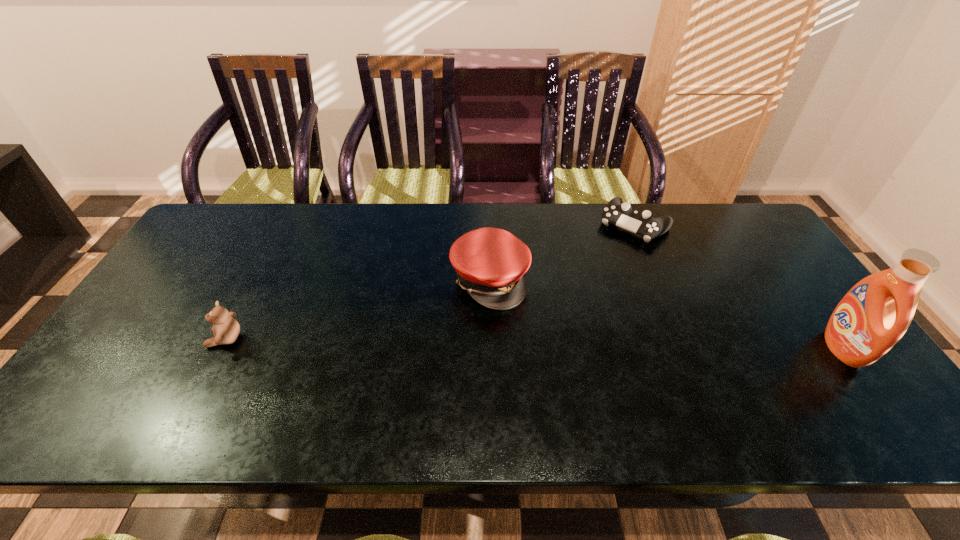
The width and height of the screenshot is (960, 540). I want to click on free space between the second object from left to right and the second object from right to left, so click(563, 252).

At what (x,y) coordinates should I click in order to perform the action: click on free space that is in between the rightmost object and the second farthest object. Please return your answer as a coordinate pair (x, y). The image size is (960, 540). Looking at the image, I should click on (666, 314).

This screenshot has height=540, width=960. I want to click on vacant area that lies between the leftmost object and the cap, so click(x=357, y=309).

What are the coordinates of `free space between the shortest object and the leftmost object` in the screenshot? It's located at (430, 282).

You are a GUI agent. You are given a task and a screenshot of the screen. Output one action in this format:
    pyautogui.click(x=<x>, y=<y>)
    Task: Click on the vacant area that lies between the tallest object and the shortest object
    
    Given the screenshot: What is the action you would take?
    [x=738, y=287]

The image size is (960, 540). Find the location of `free space between the control and the cap`. free space between the control and the cap is located at coordinates (563, 252).

You are a GUI agent. You are given a task and a screenshot of the screen. Output one action in this format:
    pyautogui.click(x=<x>, y=<y>)
    Task: Click on the vacant point located between the cap and the rightmost object
    Image resolution: width=960 pixels, height=540 pixels.
    Given the screenshot: What is the action you would take?
    pyautogui.click(x=666, y=314)

Image resolution: width=960 pixels, height=540 pixels. I want to click on object that is the closest to the teddy bear, so click(x=490, y=263).

I want to click on object that stands as the second closest to the cap, so click(x=226, y=329).

The height and width of the screenshot is (540, 960). What are the coordinates of `vacant area that satisfies the following two spatial constraints: 1. on the front side of the second object from left to right; 2. on the front-facing side of the tallest object` in the screenshot? It's located at (492, 348).